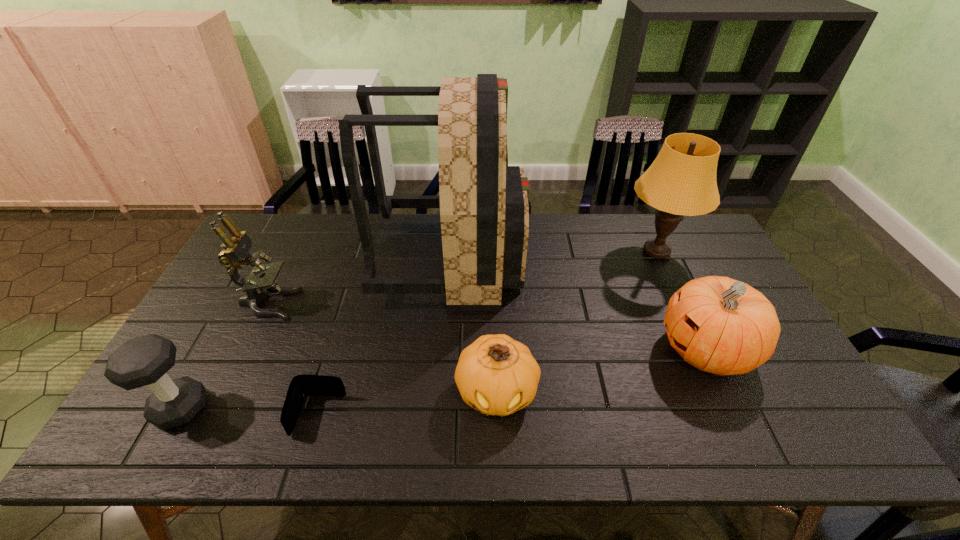
Where is `dumbbell present at the left edge`? The height and width of the screenshot is (540, 960). dumbbell present at the left edge is located at coordinates (141, 361).

Locate an element on the screen. lampshade that is positioned at the right edge is located at coordinates (681, 181).

Locate an element on the screen. pumpkin present at the right edge is located at coordinates (719, 325).

This screenshot has width=960, height=540. Find the location of `object at the near left corner`. object at the near left corner is located at coordinates (141, 361).

In order to click on object at the far right corner in this screenshot , I will do [x=681, y=181].

You are a GUI agent. You are given a task and a screenshot of the screen. Output one action in this format:
    pyautogui.click(x=<x>, y=<y>)
    Task: Click on the vacant space at the far edge of the desktop
    The image size is (960, 540).
    Given the screenshot: What is the action you would take?
    pyautogui.click(x=535, y=233)

Find the location of a particular element. This screenshot has width=960, height=540. vacant space at the near edge of the desktop is located at coordinates (413, 451).

This screenshot has width=960, height=540. In the image, there is a desktop. In order to click on blank space at the left edge in this screenshot , I will do `click(261, 305)`.

The image size is (960, 540). In the image, there is a desktop. Identify the location of vacant space at the near right corner. (807, 446).

This screenshot has height=540, width=960. Find the location of `empty space between the shortest object and the microscope`. empty space between the shortest object and the microscope is located at coordinates (294, 360).